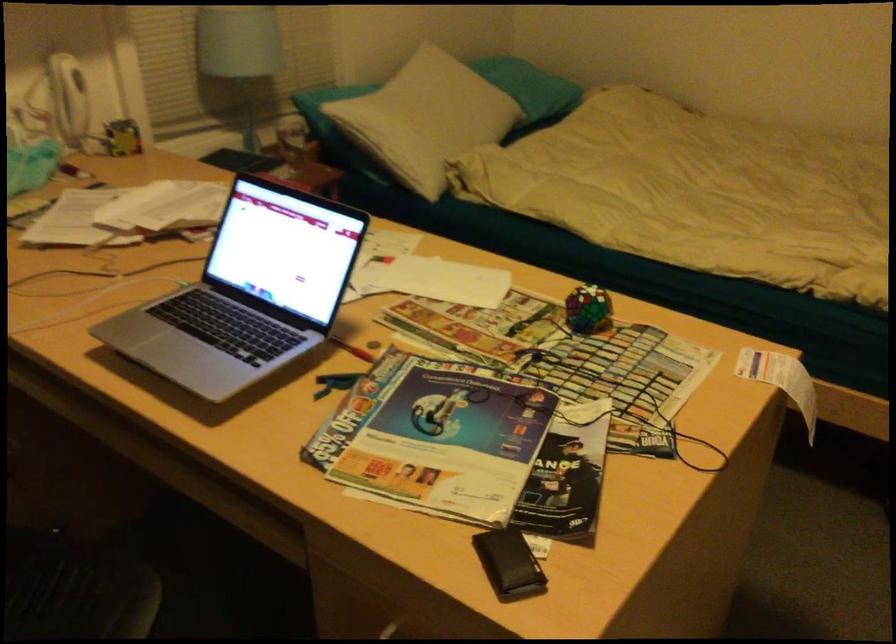
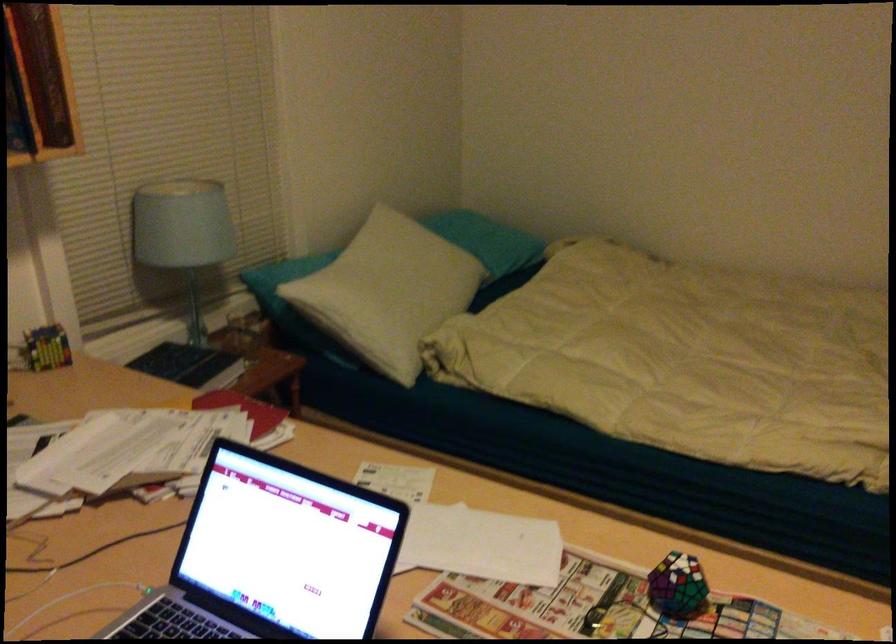
Find the pixel in the second image that matches point (419, 118) in the first image.

(389, 292)